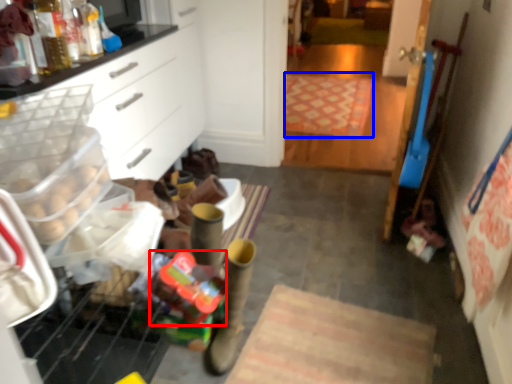
Question: Which object is closer to the camera taking this photo, stuff (highlighted by a red box) or mat (highlighted by a blue box)?

Choices:
 (A) stuff
 (B) mat

Answer: (A)